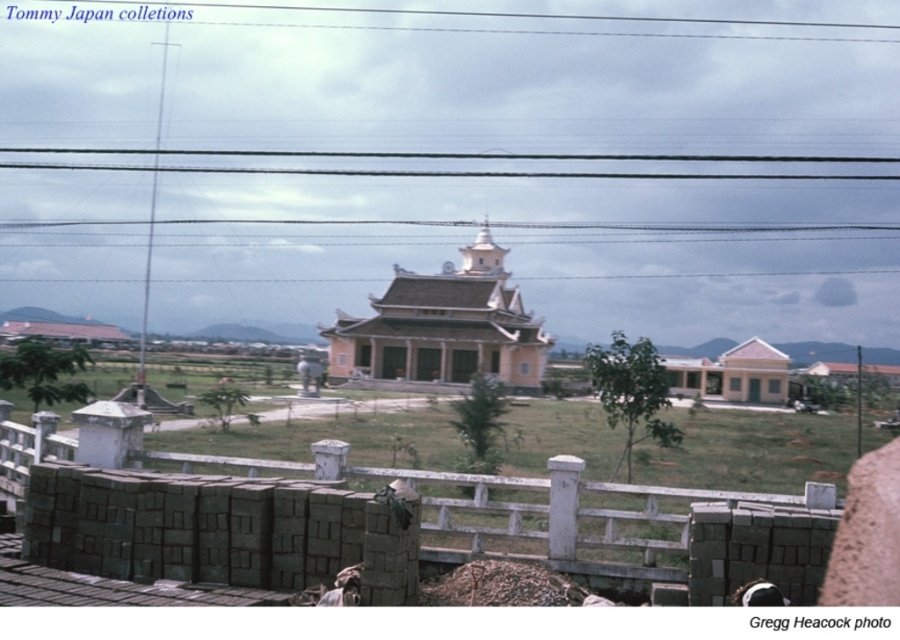
Question: Is white concrete fence at lower center further to the viewer compared to beige smooth temple at center?

Choices:
 (A) no
 (B) yes

Answer: (A)

Question: Which point is closer to the camera?

Choices:
 (A) (505, 275)
 (B) (546, 172)
 (C) (621, 492)

Answer: (C)

Question: Which is nearer to the black wire at upper center?

Choices:
 (A) white concrete fence at lower center
 (B) beige smooth temple at center

Answer: (B)

Question: Can you confirm if beige smooth temple at center is bigger than black wire at upper center?

Choices:
 (A) yes
 (B) no

Answer: (B)

Question: Which of the following is the closest to the observer?

Choices:
 (A) black wire at upper center
 (B) white concrete fence at lower center

Answer: (B)

Question: Is beige smooth temple at center thinner than black wire at upper center?

Choices:
 (A) yes
 (B) no

Answer: (A)